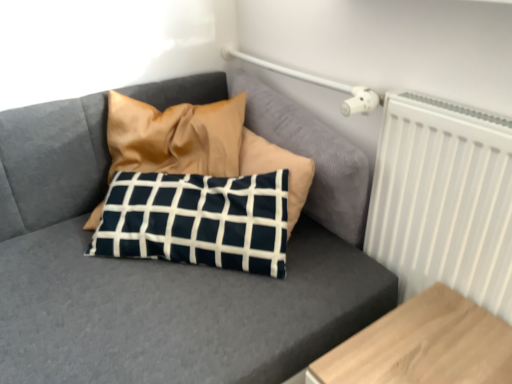
Question: Is navy blue fabric pillow at center completely or partially outside of white matte radiator at upper right?

Choices:
 (A) no
 (B) yes

Answer: (B)

Question: Is navy blue fabric pillow at center bigger than white matte radiator at upper right?

Choices:
 (A) no
 (B) yes

Answer: (B)

Question: Can you confirm if navy blue fabric pillow at center is shorter than white matte radiator at upper right?

Choices:
 (A) no
 (B) yes

Answer: (B)

Question: Is navy blue fabric pillow at center beside white matte radiator at upper right?

Choices:
 (A) no
 (B) yes

Answer: (A)

Question: Is there a large distance between navy blue fabric pillow at center and white matte radiator at upper right?

Choices:
 (A) yes
 (B) no

Answer: (B)

Question: Is white matte radiator at upper right wider or thinner than light brown wood table at lower right?

Choices:
 (A) thin
 (B) wide

Answer: (A)

Question: Visually, is white matte radiator at upper right positioned to the left or to the right of light brown wood table at lower right?

Choices:
 (A) left
 (B) right

Answer: (B)

Question: Considering the positions of point (459, 283) and point (505, 355), is point (459, 283) closer or farther from the camera than point (505, 355)?

Choices:
 (A) farther
 (B) closer

Answer: (A)

Question: From a real-world perspective, is white matte radiator at upper right positioned above or below light brown wood table at lower right?

Choices:
 (A) above
 (B) below

Answer: (A)

Question: Considering their positions, is navy blue fabric pillow at center located in front of or behind white matte radiator at upper right?

Choices:
 (A) behind
 (B) front

Answer: (A)

Question: Based on their sizes in the image, would you say navy blue fabric pillow at center is bigger or smaller than white matte radiator at upper right?

Choices:
 (A) big
 (B) small

Answer: (A)

Question: Would you say navy blue fabric pillow at center is to the left or to the right of white matte radiator at upper right in the picture?

Choices:
 (A) left
 (B) right

Answer: (A)

Question: Is navy blue fabric pillow at center spatially inside white matte radiator at upper right, or outside of it?

Choices:
 (A) outside
 (B) inside

Answer: (A)

Question: Is light brown wood table at lower right in front of or behind white matte radiator at upper right in the image?

Choices:
 (A) front
 (B) behind

Answer: (A)

Question: Considering the positions of light brown wood table at lower right and white matte radiator at upper right in the image, is light brown wood table at lower right bigger or smaller than white matte radiator at upper right?

Choices:
 (A) small
 (B) big

Answer: (B)